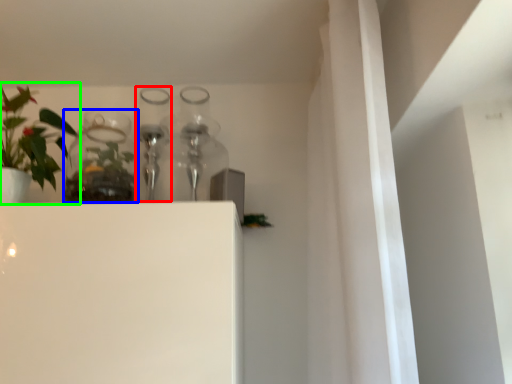
Question: Which object is positioned closest to bottle (highlighted by a red box)? Select from glass vase (highlighted by a blue box) and houseplant (highlighted by a green box).

Choices:
 (A) glass vase
 (B) houseplant

Answer: (A)